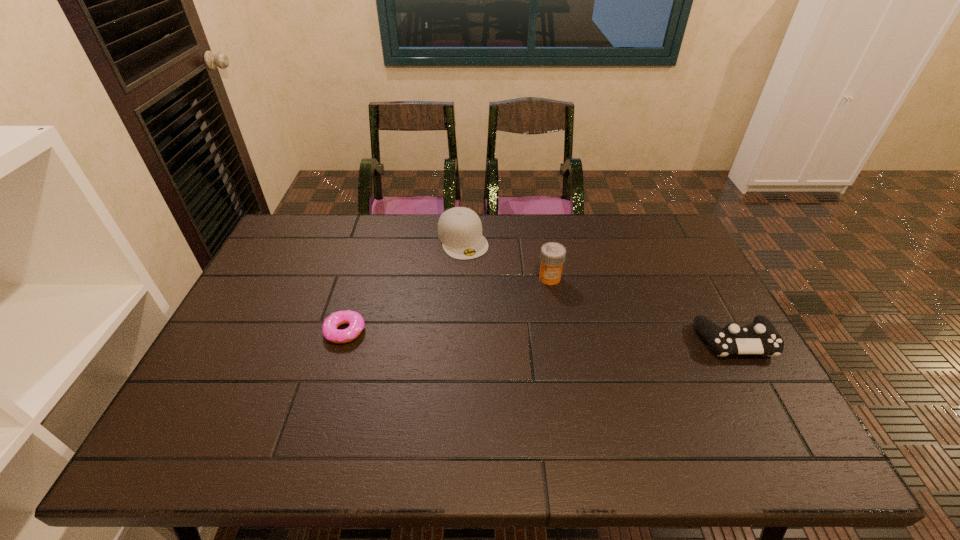
Where is `free region at the right edge of the desktop`? free region at the right edge of the desktop is located at coordinates (659, 291).

Locate an element on the screen. free point at the far left corner is located at coordinates (320, 221).

Identify the location of vacant space at the near left corner of the desktop. (238, 417).

Where is `free space between the third object from right to left and the leftmost object`? free space between the third object from right to left and the leftmost object is located at coordinates (404, 285).

Locate an element on the screen. free space between the tallest object and the cap is located at coordinates (506, 259).

Find the location of a particular element. This screenshot has width=960, height=540. free space that is in between the leftmost object and the medicine is located at coordinates (447, 305).

Identify the location of vacant space that is in between the doughnut and the third tallest object. (540, 336).

At what (x,y) coordinates should I click in order to perform the action: click on empty space that is in between the control and the medicine. Please return your answer as a coordinate pair (x, y). The height and width of the screenshot is (540, 960). Looking at the image, I should click on (642, 309).

Where is `free space between the third nearest object and the second shortest object`? free space between the third nearest object and the second shortest object is located at coordinates (642, 309).

What are the coordinates of `empty location between the second tallest object and the leftmost object` in the screenshot? It's located at (404, 285).